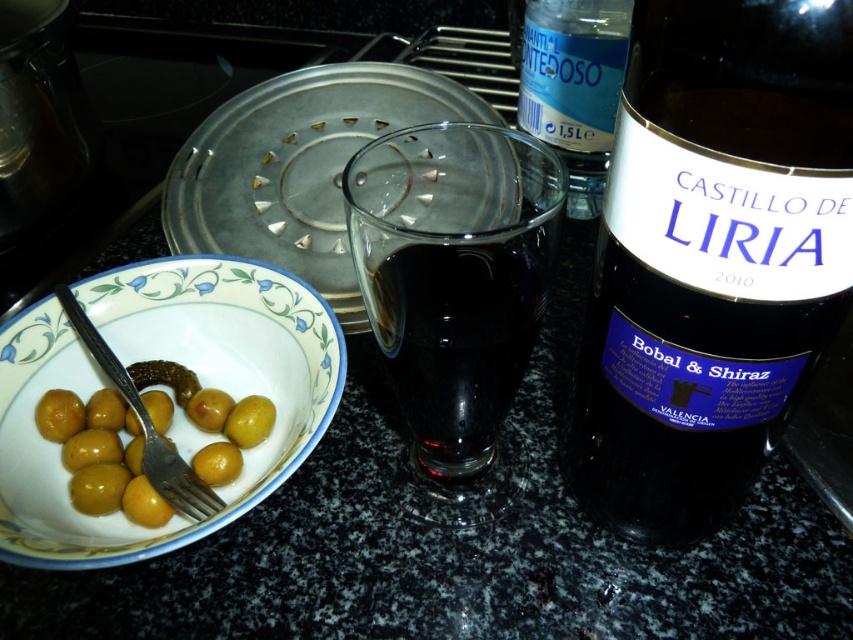
Consider the image. Can you confirm if dark glass bottle at right is positioned above silver metallic fork at lower left?

Indeed, dark glass bottle at right is positioned over silver metallic fork at lower left.

Is the position of dark glass bottle at right more distant than that of silver metallic fork at lower left?

No, it is not.

Where is `dark glass bottle at right`? dark glass bottle at right is located at coordinates (712, 257).

Which is behind, point (782, 106) or point (223, 312)?

Positioned behind is point (223, 312).

At what (x,y) coordinates should I click in order to perform the action: click on dark glass bottle at right. Please return your answer as a coordinate pair (x, y). The width and height of the screenshot is (853, 640). Looking at the image, I should click on (712, 257).

Can you confirm if dark glass bottle at right is positioned to the left of transparent plastic bottle at upper center?

In fact, dark glass bottle at right is to the right of transparent plastic bottle at upper center.

Who is lower down, dark glass bottle at right or transparent plastic bottle at upper center?

dark glass bottle at right is lower down.

The image size is (853, 640). Describe the element at coordinates (712, 257) in the screenshot. I see `dark glass bottle at right` at that location.

This screenshot has height=640, width=853. In order to click on dark glass bottle at right in this screenshot , I will do `click(712, 257)`.